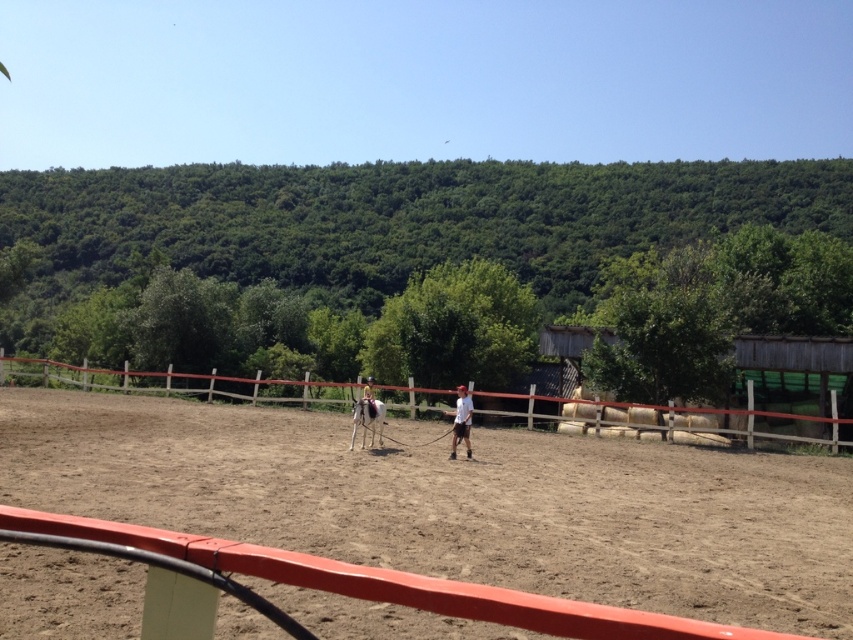
You are a photographer setting up for a horse riding session. You have to position your camera so that both the white glossy horse at center and the light brown leather jacket at center are visible. Given their sizes, which object should you focus on to ensure it takes up more of the frame?

The light brown leather jacket at center occupies more space than the white glossy horse at center, so focusing on the light brown leather jacket at center will ensure it takes up more of the frame.